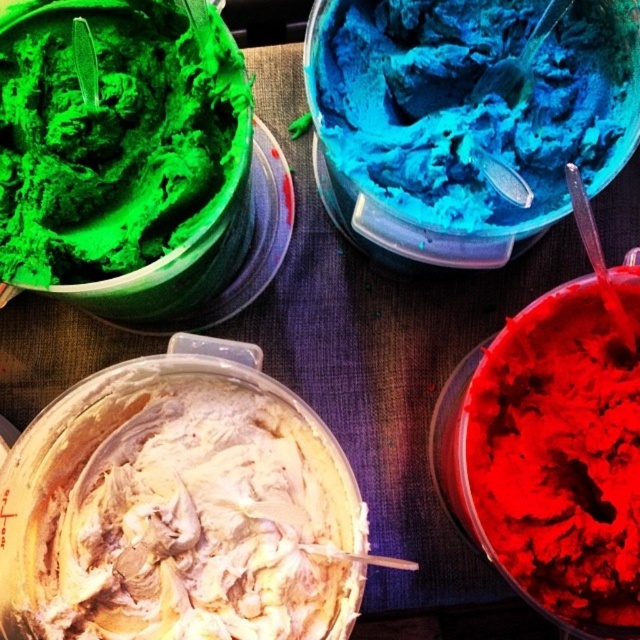
Question: Which point is farther to the camera?

Choices:
 (A) whipped cream at center
 (B) blue matte ice cream at upper center
 (C) matte red frosting at bottom right

Answer: (B)

Question: Is green matte ice cream at upper left to the left of blue matte ice cream at upper center from the viewer's perspective?

Choices:
 (A) no
 (B) yes

Answer: (B)

Question: Which point is closer to the camera?

Choices:
 (A) matte red frosting at bottom right
 (B) whipped cream at center
 (C) green matte ice cream at upper left

Answer: (A)

Question: In this image, where is whipped cream at center located relative to blue matte ice cream at upper center?

Choices:
 (A) above
 (B) below

Answer: (B)

Question: Which is nearer to the matte red frosting at bottom right?

Choices:
 (A) whipped cream at center
 (B) green matte ice cream at upper left

Answer: (A)

Question: Is whipped cream at center to the left of green matte ice cream at upper left from the viewer's perspective?

Choices:
 (A) yes
 (B) no

Answer: (B)